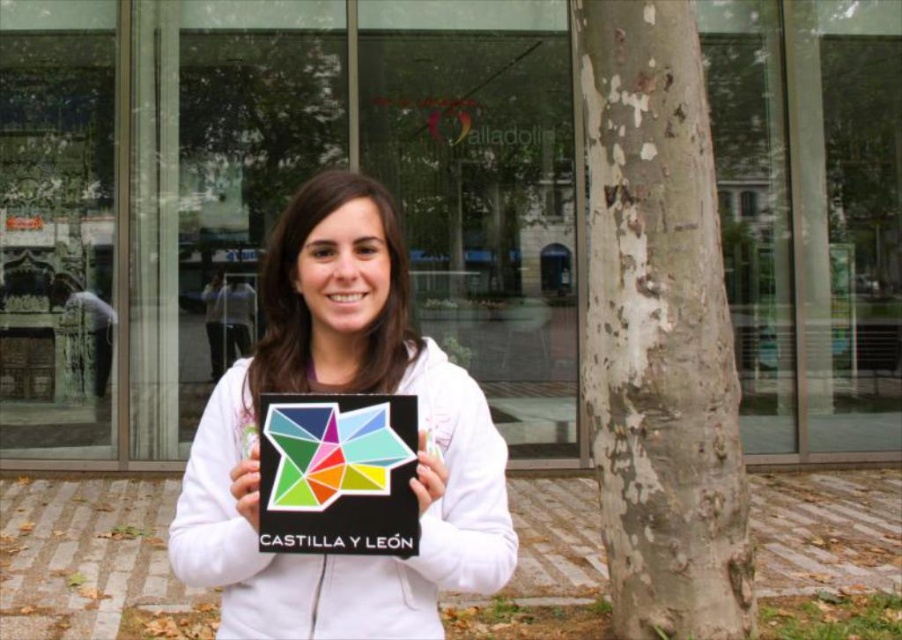
Based on the photo, who is more forward, (410, 584) or (290, 493)?

Positioned in front is point (290, 493).

Does white matte hoodie at center have a greater width compared to multicolored paper star at center?

Indeed, white matte hoodie at center has a greater width compared to multicolored paper star at center.

You are a GUI agent. You are given a task and a screenshot of the screen. Output one action in this format:
    pyautogui.click(x=<x>, y=<y>)
    Task: Click on the white matte hoodie at center
    
    Given the screenshot: What is the action you would take?
    pyautogui.click(x=343, y=392)

Measure the distance between white textured bark at center and camera.

white textured bark at center is 10.11 feet from camera.

Is white textured bark at center to the right of multicolored paper star at center from the viewer's perspective?

Correct, you'll find white textured bark at center to the right of multicolored paper star at center.

Locate an element on the screen. The width and height of the screenshot is (902, 640). white textured bark at center is located at coordinates (659, 332).

Does white textured bark at center have a lesser width compared to white matte hoodie at center?

In fact, white textured bark at center might be wider than white matte hoodie at center.

Which is behind, point (640, 420) or point (290, 364)?

Point (640, 420)

At what (x,y) coordinates should I click in order to perform the action: click on white textured bark at center. Please return your answer as a coordinate pair (x, y). Looking at the image, I should click on (659, 332).